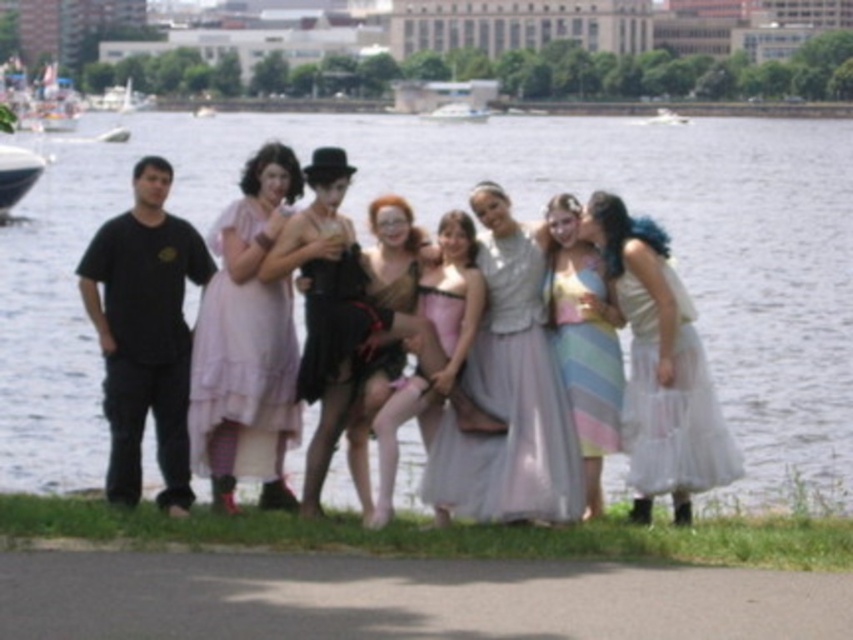
Between pastel satin dress at center and matte gold dress at center, which one has more height?

With more height is matte gold dress at center.

Is pastel satin dress at center behind matte gold dress at center?

Yes.

Locate an element on the screen. pastel satin dress at center is located at coordinates (509, 404).

Where is `pastel satin dress at center`? pastel satin dress at center is located at coordinates 509,404.

Does black cotton t-shirt at left appear over black satin dress at center?

Actually, black cotton t-shirt at left is below black satin dress at center.

Is point (161, 451) in front of point (309, 260)?

No, (161, 451) is further to viewer.

Does point (114, 262) come in front of point (334, 272)?

No, it is behind (334, 272).

Find the location of a particular element. black cotton t-shirt at left is located at coordinates (144, 332).

Does clear water at center have a larger size compared to white plastic boat at left?

Correct, clear water at center is larger in size than white plastic boat at left.

Can you confirm if clear water at center is positioned above white plastic boat at left?

Yes, clear water at center is above white plastic boat at left.

Is point (808, 296) farther from viewer compared to point (30, 168)?

That is False.

Find the location of a particular element. Image resolution: width=853 pixels, height=640 pixels. clear water at center is located at coordinates (467, 209).